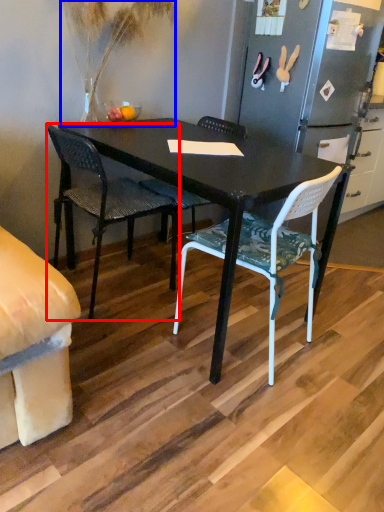
Question: Which object appears closest to the camera in this image, chair (highlighted by a red box) or houseplant (highlighted by a blue box)?

Choices:
 (A) chair
 (B) houseplant

Answer: (B)